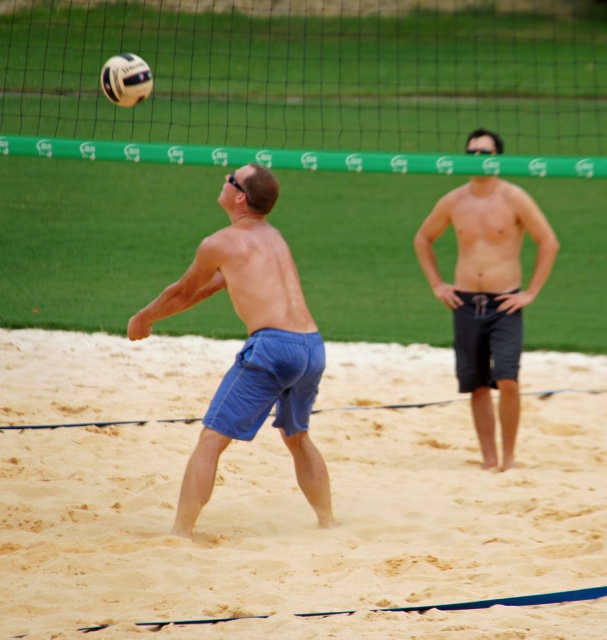
Question: Is dark gray shorts at center behind white matte volleyball at upper center?

Choices:
 (A) no
 (B) yes

Answer: (A)

Question: Among these points, which one is nearest to the camera?

Choices:
 (A) (58, 113)
 (B) (236, 234)
 (C) (470, 193)
 (D) (387, 460)

Answer: (B)

Question: Among these objects, which one is farthest from the camera?

Choices:
 (A) green fabric net at upper center
 (B) white matte volleyball at upper center
 (C) blue cotton shorts at center

Answer: (B)

Question: Can you confirm if fine-grained sand at lower center is thinner than white matte volleyball at upper center?

Choices:
 (A) no
 (B) yes

Answer: (A)

Question: Is green fabric net at upper center thinner than blue cotton shorts at center?

Choices:
 (A) yes
 (B) no

Answer: (B)

Question: Which object is positioned closest to the green fabric net at upper center?

Choices:
 (A) white matte volleyball at upper center
 (B) dark gray shorts at center
 (C) blue cotton shorts at center

Answer: (A)